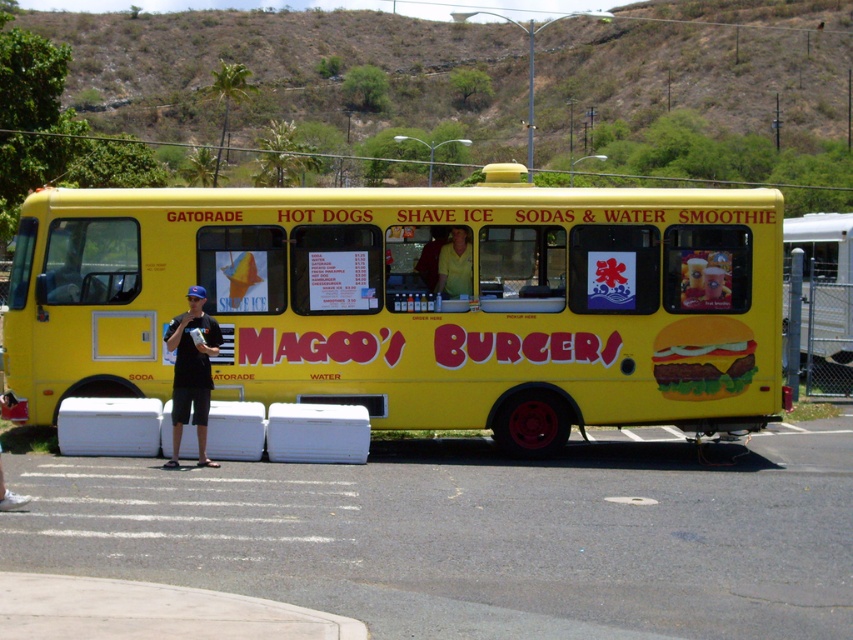
Does concrete at lower left appear over yellow matte hamburger at center?

No, concrete at lower left is not above yellow matte hamburger at center.

Which is behind, point (293, 605) or point (664, 378)?

The point (664, 378) is more distant.

Is point (244, 602) positioned in front of point (723, 330)?

Yes, point (244, 602) is closer to viewer.

Where is `concrete at lower left`? This screenshot has width=853, height=640. concrete at lower left is located at coordinates (152, 611).

Between concrete at lower left and black cotton t-shirt at lower left, which one is positioned higher?

Positioned higher is black cotton t-shirt at lower left.

This screenshot has height=640, width=853. In order to click on concrete at lower left in this screenshot , I will do `click(152, 611)`.

From the picture: Between yellow matte food truck at center and black cotton t-shirt at lower left, which one has less height?

With less height is yellow matte food truck at center.

Does point (16, 262) come closer to viewer compared to point (202, 288)?

No, (16, 262) is further to viewer.

Where is `yellow matte food truck at center`? The image size is (853, 640). yellow matte food truck at center is located at coordinates (399, 300).